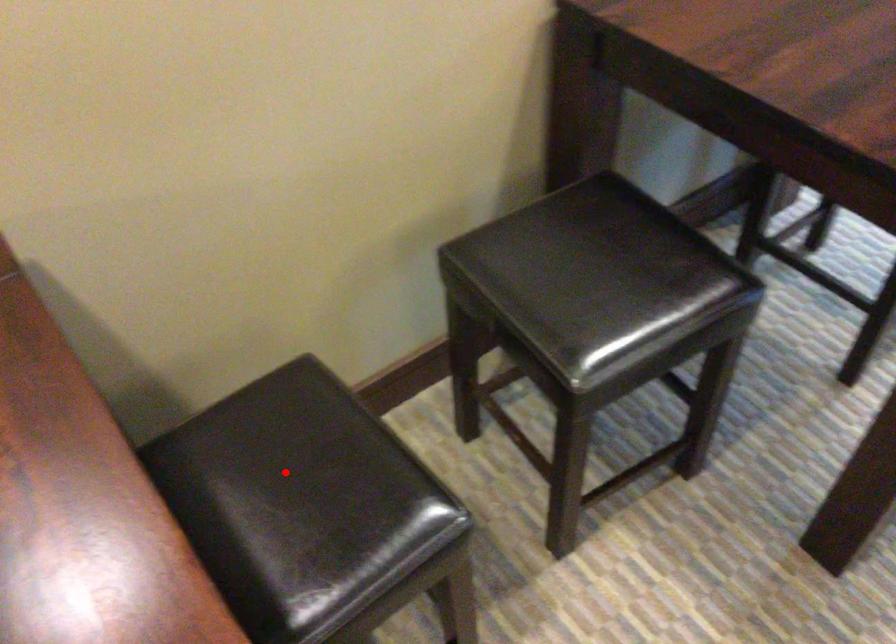
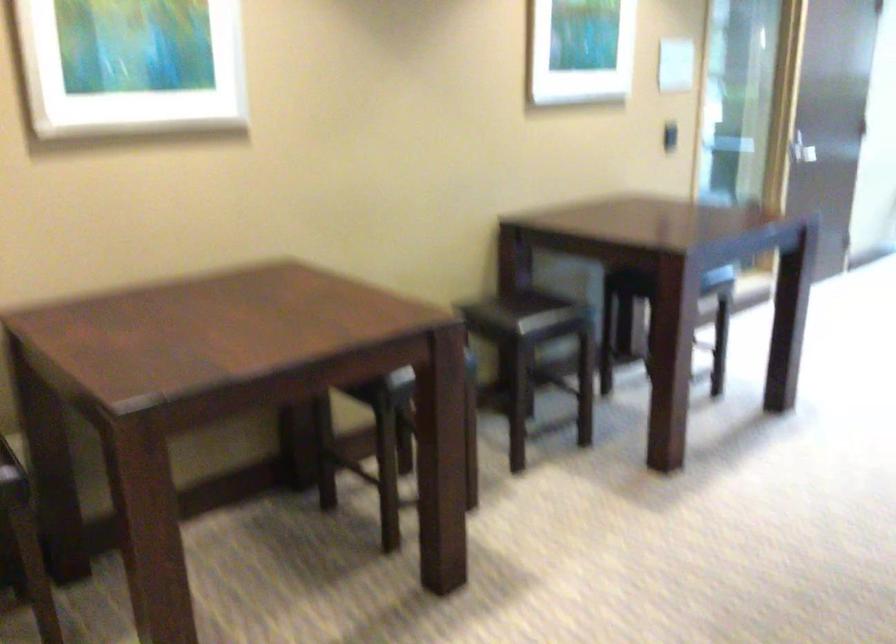
Question: I am providing you with two images of the same scene from different viewpoints. A red point is marked on the first image. At the location where the point appears in image 1, is it still visible in image 2?

Choices:
 (A) Yes
 (B) No

Answer: (B)